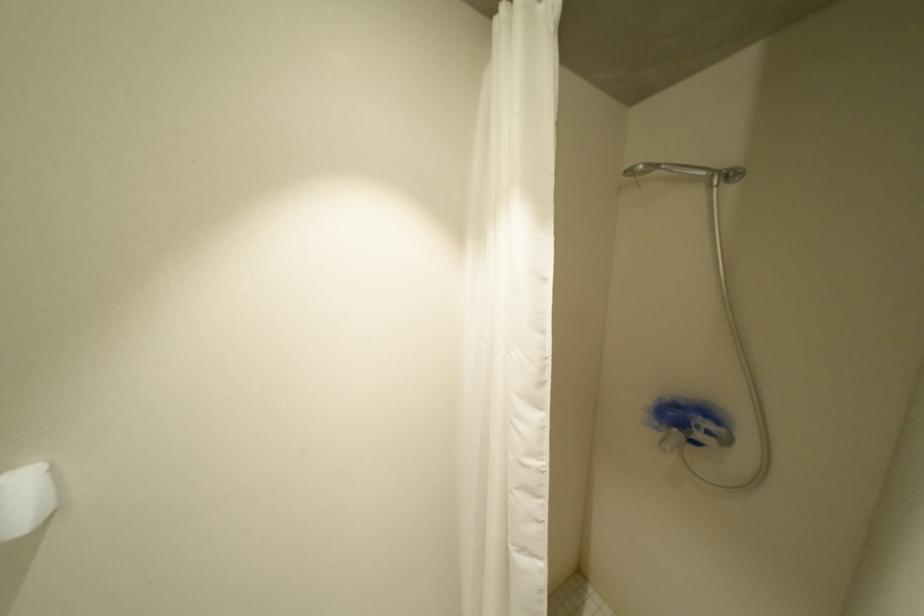
This screenshot has width=924, height=616. I want to click on white toilet paper roll, so click(26, 499).